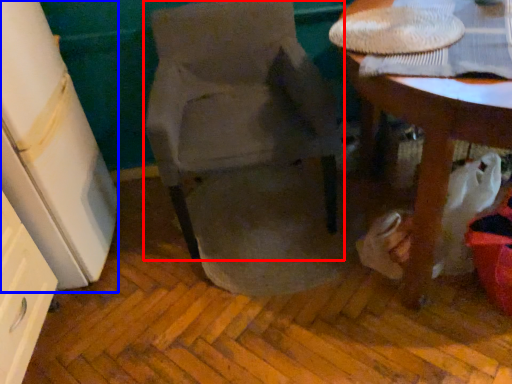
Question: Which point is further to the camera, chair (highlighted by a red box) or leftover (highlighted by a blue box)?

Choices:
 (A) chair
 (B) leftover

Answer: (A)